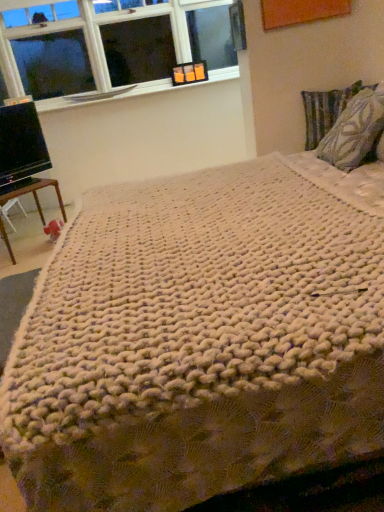
Identify the location of vacant region above white textured window sill at upper left (from a real-world perspective). tap(129, 93).